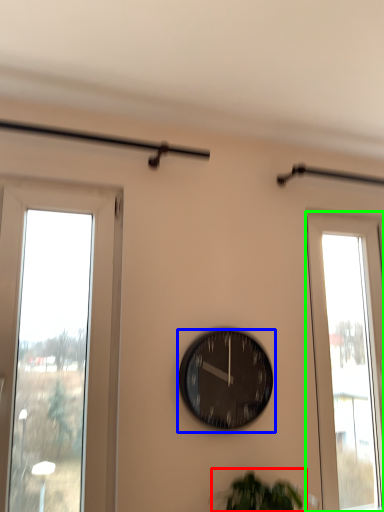
Question: Based on their relative distances, which object is farther from plant (highlighted by a red box)? Choose from wall clock (highlighted by a blue box) and window (highlighted by a green box).

Choices:
 (A) wall clock
 (B) window

Answer: (B)